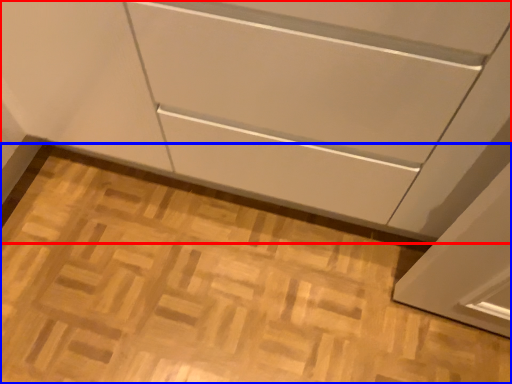
Question: Which of the following is the farthest to the observer, cabinetry (highlighted by a red box) or plain (highlighted by a blue box)?

Choices:
 (A) cabinetry
 (B) plain

Answer: (B)